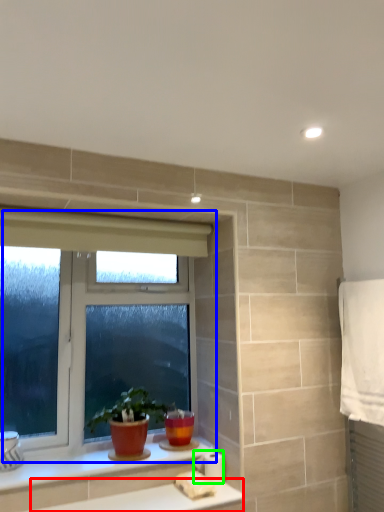
Question: Estimate the real-world distances between objects in this image. Which object is closer to counter top (highlighted by a red box), window (highlighted by a blue box) or toilet paper (highlighted by a green box)?

Choices:
 (A) window
 (B) toilet paper

Answer: (B)